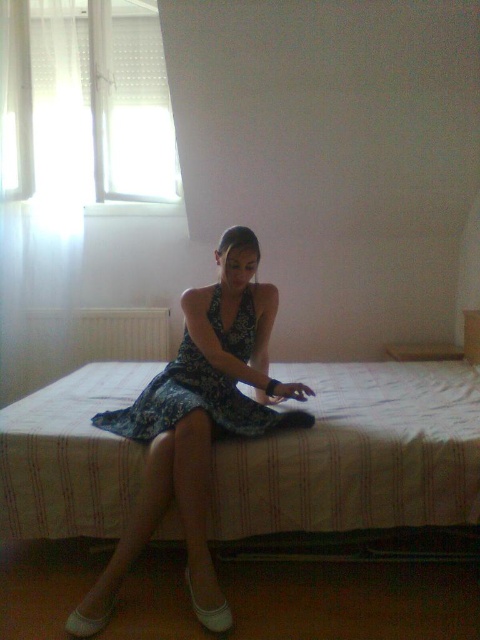
Question: Is blue floral dress at center below printed fabric dress at center?

Choices:
 (A) no
 (B) yes

Answer: (B)

Question: Which point is farther to the camera?

Choices:
 (A) (444, 428)
 (B) (264, 406)
 (C) (177, 362)

Answer: (C)

Question: Considering the real-world distances, which object is closest to the printed fabric dress at center?

Choices:
 (A) white striped mattress at center
 (B) blue floral dress at center

Answer: (B)

Question: Which of the following is the closest to the observer?

Choices:
 (A) (132, 406)
 (B) (120, 518)
 (C) (189, 368)

Answer: (B)

Question: Is white striped mattress at center thinner than printed fabric dress at center?

Choices:
 (A) no
 (B) yes

Answer: (A)

Question: Is blue floral dress at center thinner than printed fabric dress at center?

Choices:
 (A) no
 (B) yes

Answer: (A)